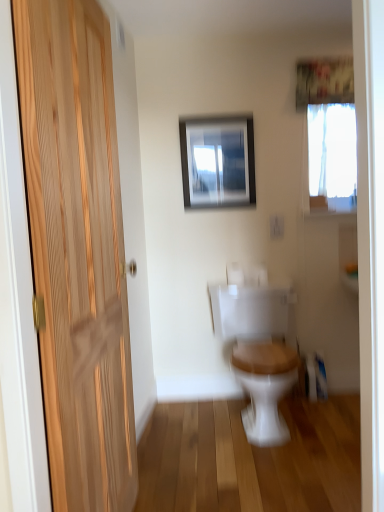
Question: From the image's perspective, is wooden door at left located above white sheer curtain at upper center?

Choices:
 (A) yes
 (B) no

Answer: (B)

Question: Considering the relative sizes of wooden door at left and white sheer curtain at upper center in the image provided, is wooden door at left thinner than white sheer curtain at upper center?

Choices:
 (A) no
 (B) yes

Answer: (A)

Question: Is wooden door at left smaller than white sheer curtain at upper center?

Choices:
 (A) yes
 (B) no

Answer: (B)

Question: Is wooden door at left positioned before white sheer curtain at upper center?

Choices:
 (A) yes
 (B) no

Answer: (A)

Question: Is wooden door at left behind white sheer curtain at upper center?

Choices:
 (A) no
 (B) yes

Answer: (A)

Question: Considering the positions of white sheer curtain at upper center and metallic silver picture frame at upper center in the image, is white sheer curtain at upper center wider or thinner than metallic silver picture frame at upper center?

Choices:
 (A) thin
 (B) wide

Answer: (B)

Question: From a real-world perspective, is white sheer curtain at upper center positioned above or below metallic silver picture frame at upper center?

Choices:
 (A) below
 (B) above

Answer: (B)

Question: In terms of size, does white sheer curtain at upper center appear bigger or smaller than metallic silver picture frame at upper center?

Choices:
 (A) small
 (B) big

Answer: (A)

Question: In the image, is white sheer curtain at upper center on the left side or the right side of metallic silver picture frame at upper center?

Choices:
 (A) right
 (B) left

Answer: (A)

Question: Is white wood toilet at center wider or thinner than metallic silver picture frame at upper center?

Choices:
 (A) thin
 (B) wide

Answer: (B)

Question: Is white wood toilet at center inside or outside of metallic silver picture frame at upper center?

Choices:
 (A) inside
 (B) outside

Answer: (B)

Question: Is white wood toilet at center bigger or smaller than metallic silver picture frame at upper center?

Choices:
 (A) big
 (B) small

Answer: (A)

Question: From a real-world perspective, relative to metallic silver picture frame at upper center, is white wood toilet at center vertically above or below?

Choices:
 (A) above
 (B) below

Answer: (B)

Question: From a real-world perspective, is wooden door at left physically located above or below metallic silver picture frame at upper center?

Choices:
 (A) below
 (B) above

Answer: (A)

Question: Looking at their shapes, would you say wooden door at left is wider or thinner than metallic silver picture frame at upper center?

Choices:
 (A) wide
 (B) thin

Answer: (A)